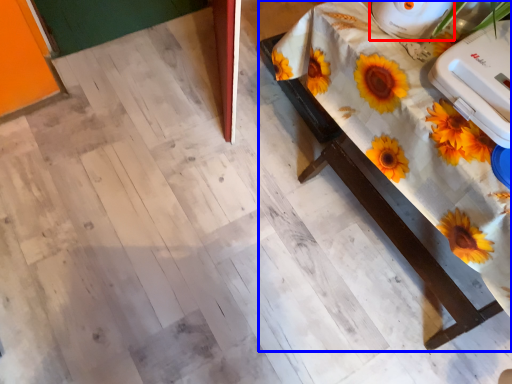
Question: Which point is closer to the camera, appliance (highlighted by a red box) or table (highlighted by a blue box)?

Choices:
 (A) appliance
 (B) table

Answer: (B)